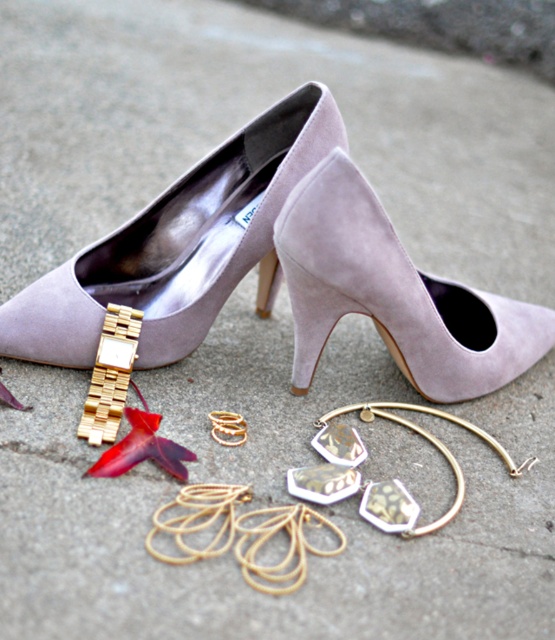
Is gold metallic watch at lower left to the left of suede heel at center from the viewer's perspective?

Yes, gold metallic watch at lower left is to the left of suede heel at center.

Can you confirm if gold metallic watch at lower left is smaller than suede heel at center?

No.

Who is more forward, (115, 328) or (258, 305)?

Point (115, 328)

Where is `gold metallic watch at lower left`? Image resolution: width=555 pixels, height=640 pixels. gold metallic watch at lower left is located at coordinates (111, 372).

This screenshot has height=640, width=555. Describe the element at coordinates (393, 294) in the screenshot. I see `suede at upper center` at that location.

Who is more forward, [486,360] or [274,250]?

Point [486,360] is in front.

You are a GUI agent. You are given a task and a screenshot of the screen. Output one action in this format:
    pyautogui.click(x=<x>, y=<y>)
    Task: Click on the suede at upper center
    The width and height of the screenshot is (555, 640).
    Given the screenshot: What is the action you would take?
    pyautogui.click(x=393, y=294)

Locate an element on the screen. suede at upper center is located at coordinates (393, 294).

Which is in front, point (519, 355) or point (117, 388)?

Positioned in front is point (117, 388).

Does suede at upper center have a lesser height compared to gold metallic watch at lower left?

Incorrect, suede at upper center's height does not fall short of gold metallic watch at lower left's.

Consider the image. Who is more distant from viewer, (531, 308) or (138, 312)?

The point (531, 308) is behind.

The height and width of the screenshot is (640, 555). In order to click on suede at upper center in this screenshot , I will do `click(393, 294)`.